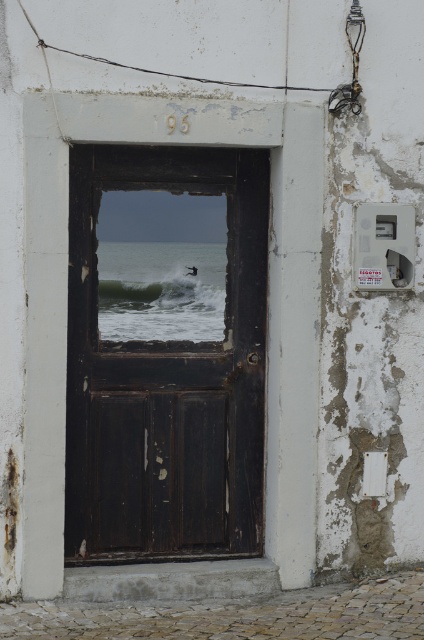
You are standing in front of a building and see the dark wood door at center and the green frothy wave at center. Which object is located higher up?

The green frothy wave at center is higher up because the dark wood door at center is positioned under it.

You are standing in front of the white building and looking at the door. There are two points marked on the wall. One is at coordinate point (256, 456) and the other is at point (195, 285). Which point is closer to your eyes?

Point (195, 285) is closer to your eyes because it is less further away than point (256, 456).